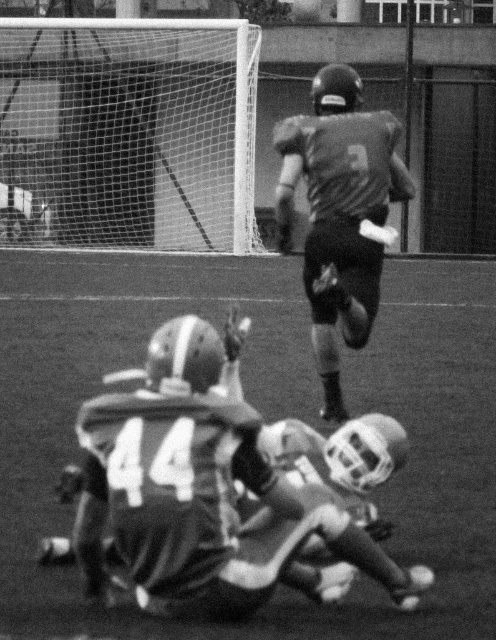
What is the coordinate of the smooth turf football field at center?

The smooth turf football field at center is located at coordinate point (264, 417).

You are a referee standing at the edge of the smooth turf football field at center. You need to reach the gray matte jersey at upper center to make a ruling. Can you walk directly to it without stepping off the field?

The distance between the smooth turf football field at center and the gray matte jersey at upper center is 2.72 meters. Since you are on the field, you can walk directly to the gray matte jersey at upper center without stepping off as the field extends to that point.

You are a photographer at the edge of the football field. You want to take a photo of the smooth turf football field at center and the gray matte jersey at upper center. Which object should you focus on first if you want to capture both in sharp focus?

The smooth turf football field at center has a larger size compared to gray matte jersey at upper center, so you should focus on the smooth turf football field at center first to ensure both are in sharp focus.